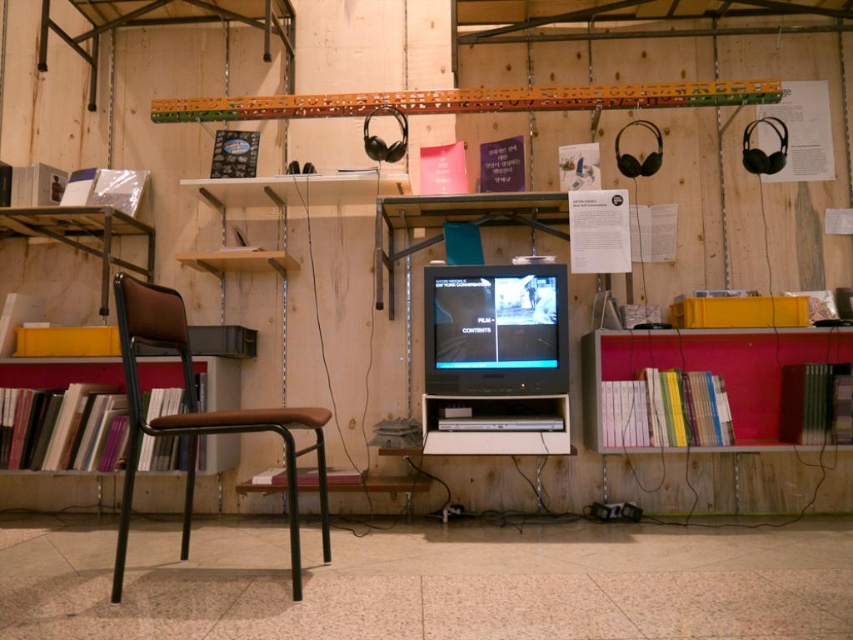
Who is higher up, brown leather chair at left or wooden bookshelf at left?

wooden bookshelf at left

Is brown leather chair at left behind wooden bookshelf at left?

No, brown leather chair at left is in front of wooden bookshelf at left.

You are a GUI agent. You are given a task and a screenshot of the screen. Output one action in this format:
    pyautogui.click(x=<x>, y=<y>)
    Task: Click on the brown leather chair at left
    The height and width of the screenshot is (640, 853).
    Given the screenshot: What is the action you would take?
    pyautogui.click(x=199, y=417)

Is hardcover books at right taller than matte black monitor at center?

Yes, hardcover books at right is taller than matte black monitor at center.

Can you confirm if hardcover books at right is wider than matte black monitor at center?

Yes, hardcover books at right is wider than matte black monitor at center.

The width and height of the screenshot is (853, 640). What do you see at coordinates (730, 420) in the screenshot?
I see `hardcover books at right` at bounding box center [730, 420].

The width and height of the screenshot is (853, 640). In order to click on hardcover books at right in this screenshot , I will do `click(730, 420)`.

Which of these two, matte black monitor at center or wooden bookshelf at left, stands taller?

matte black monitor at center is taller.

Between matte black monitor at center and wooden bookshelf at left, which one appears on the left side from the viewer's perspective?

wooden bookshelf at left

At what (x,y) coordinates should I click in order to perform the action: click on matte black monitor at center. Please return your answer as a coordinate pair (x, y). This screenshot has width=853, height=640. Looking at the image, I should click on coord(495,330).